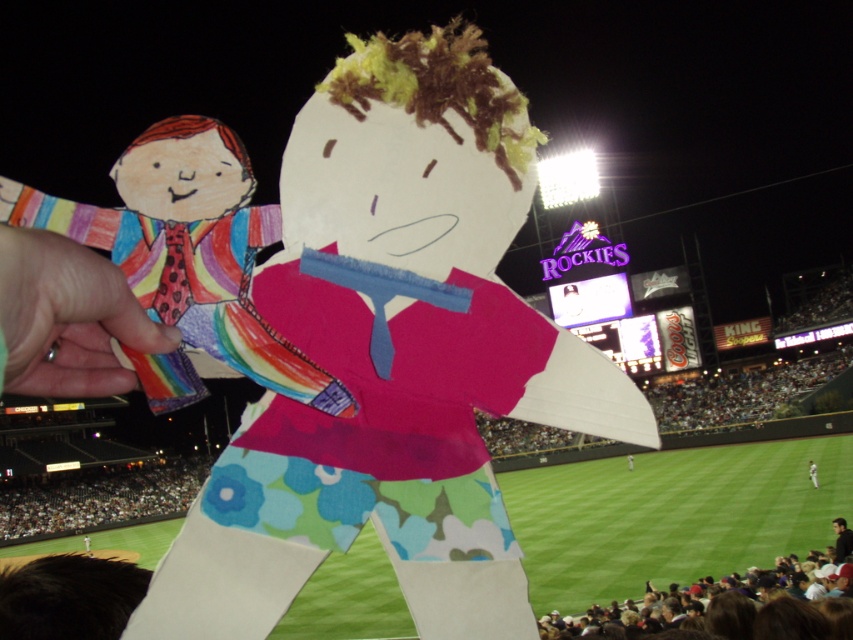
Question: Which object appears farthest from the camera in this image?

Choices:
 (A) matte paper doll at center
 (B) blue floral pants at center

Answer: (B)

Question: Is matte paper doll at center thinner than blue floral pants at center?

Choices:
 (A) no
 (B) yes

Answer: (A)

Question: Among these objects, which one is nearest to the camera?

Choices:
 (A) blue floral pants at center
 (B) matte paper doll at center

Answer: (B)

Question: Does matte paper doll at center have a greater width compared to blue floral pants at center?

Choices:
 (A) no
 (B) yes

Answer: (B)

Question: Is matte paper doll at center thinner than blue floral pants at center?

Choices:
 (A) yes
 (B) no

Answer: (B)